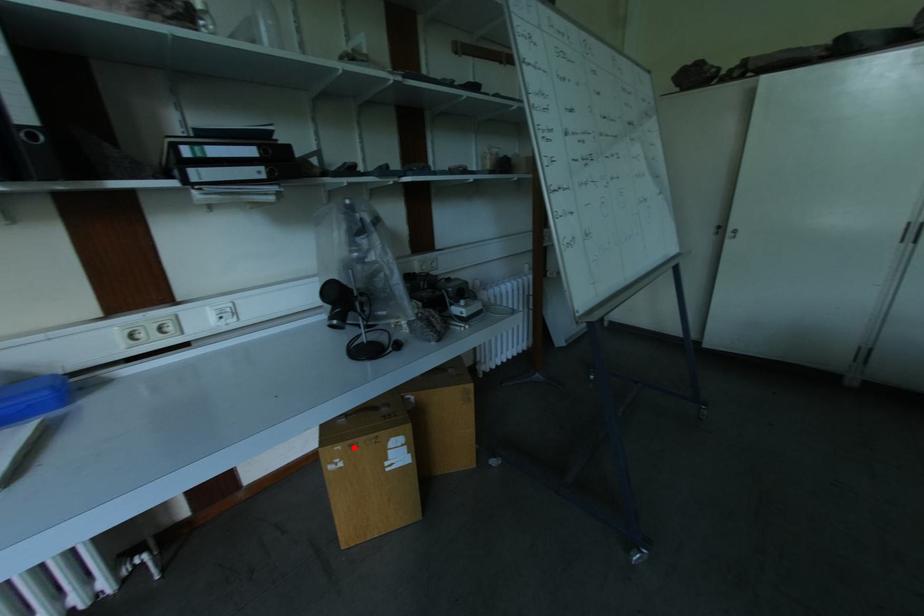
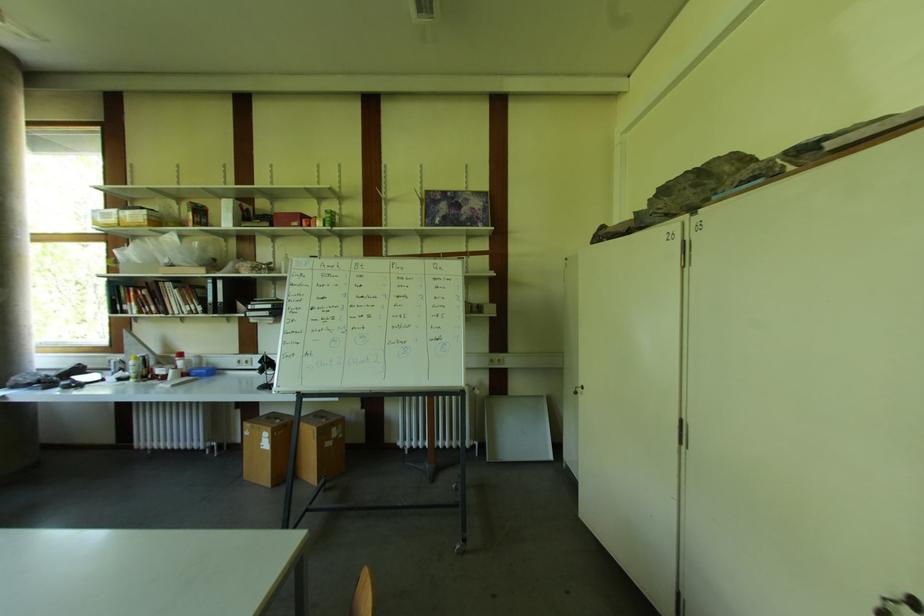
Where in the second image is the point corresponding to the highlighted location from the first image?

(254, 428)